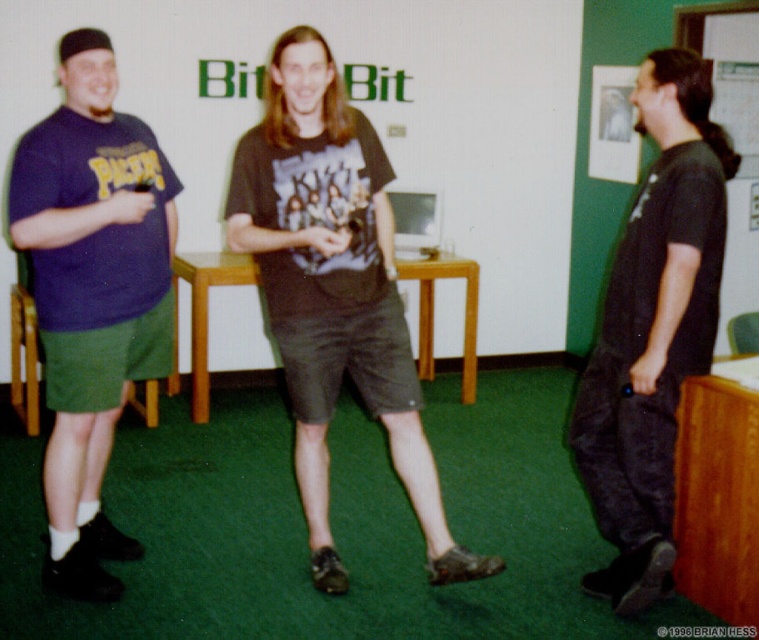
Question: Can you confirm if black matte t-shirt at center is bigger than black matte pants at right?

Choices:
 (A) no
 (B) yes

Answer: (B)

Question: Among these objects, which one is nearest to the camera?

Choices:
 (A) black matte pants at right
 (B) black matte t-shirt at center
 (C) purple matte t-shirt at left

Answer: (A)

Question: Considering the real-world distances, which object is closest to the black matte pants at right?

Choices:
 (A) black matte t-shirt at center
 (B) purple matte t-shirt at left

Answer: (A)

Question: Which point is closer to the camera?

Choices:
 (A) black matte t-shirt at center
 (B) purple matte t-shirt at left

Answer: (A)

Question: Can you confirm if black matte t-shirt at center is positioned to the left of purple matte t-shirt at left?

Choices:
 (A) yes
 (B) no

Answer: (B)

Question: Does purple matte t-shirt at left have a larger size compared to black matte pants at right?

Choices:
 (A) yes
 (B) no

Answer: (A)